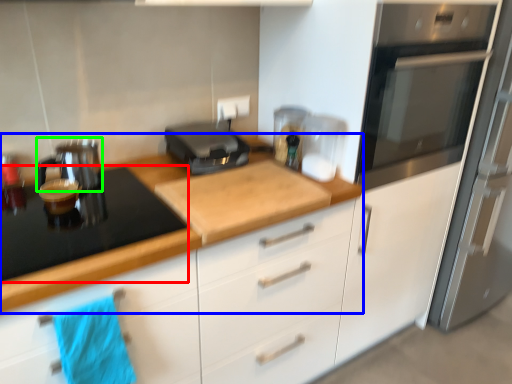
Question: Which object is the farthest from gas stove (highlighted by a red box)? Choose among these: countertop (highlighted by a blue box) or kitchen appliance (highlighted by a green box).

Choices:
 (A) countertop
 (B) kitchen appliance

Answer: (B)